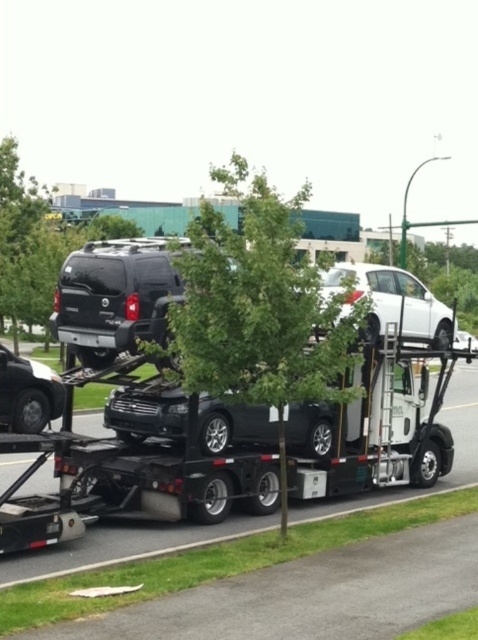
In the scene shown: You are a delivery driver who needs to park your truck in a space that can only accommodate vehicles smaller than the nearby green leafy tree at upper left. Based on the scene, can the glossy black car carrier at center fit in the parking space?

The glossy black car carrier at center has a smaller size compared to the green leafy tree at upper left, so it should fit in the parking space designed for vehicles smaller than the tree.